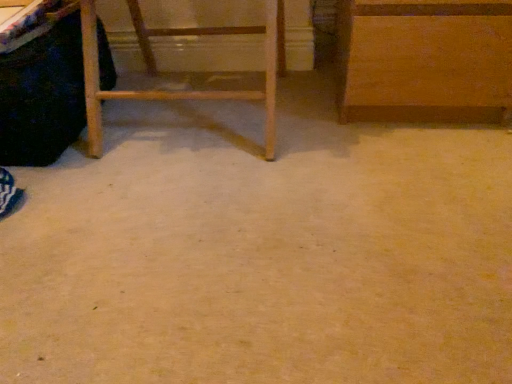
Question: Considering the positions of point (450, 24) and point (81, 109), is point (450, 24) closer or farther from the camera than point (81, 109)?

Choices:
 (A) farther
 (B) closer

Answer: (B)

Question: Would you say wooden cabinet at upper right, the 2th furniture from the left, is to the left or to the right of black fabric vanity at left in the picture?

Choices:
 (A) right
 (B) left

Answer: (A)

Question: Estimate the real-world distances between objects in this image. Which object is closer to the wooden cabinet at upper right, the 2th furniture from the left?

Choices:
 (A) black fabric vanity at left
 (B) wooden ladder at left, the first furniture positioned from the left

Answer: (B)

Question: Which object is positioned closest to the black fabric vanity at left?

Choices:
 (A) wooden ladder at left, the 2th furniture when ordered from right to left
 (B) wooden cabinet at upper right, the 2th furniture from the left

Answer: (A)